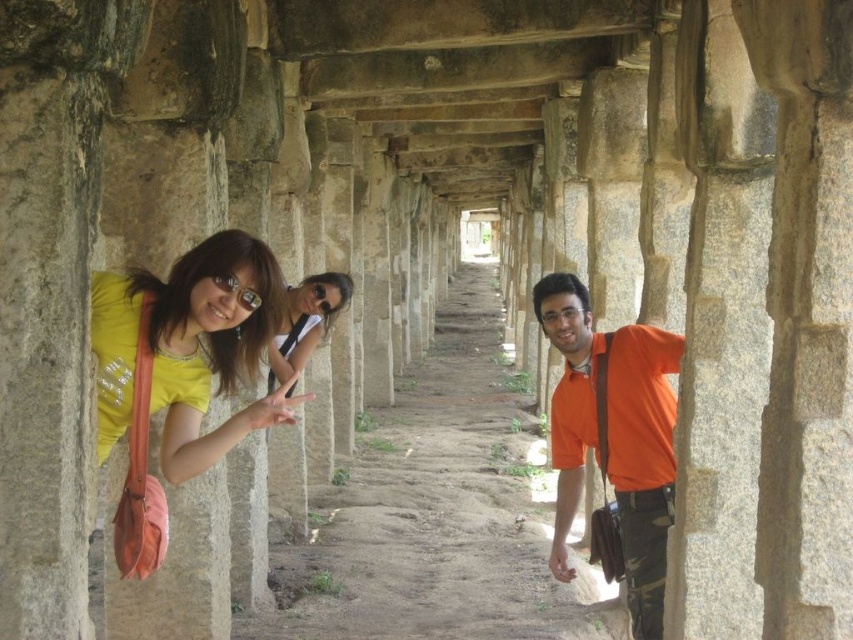
Between point (122, 305) and point (281, 371), which one is positioned behind?

Positioned behind is point (281, 371).

Does yellow fabric bag at left have a smaller size compared to sunglasses at center?

Incorrect, yellow fabric bag at left is not smaller in size than sunglasses at center.

At what (x,y) coordinates should I click in order to perform the action: click on yellow fabric bag at left. Please return your answer as a coordinate pair (x, y). The height and width of the screenshot is (640, 853). Looking at the image, I should click on (189, 346).

Who is higher up, yellow fabric bag at left or orange cotton shirt at center?

Positioned higher is yellow fabric bag at left.

Between yellow fabric bag at left and orange cotton shirt at center, which one has less height?

orange cotton shirt at center is shorter.

Who is more distant from viewer, (125,388) or (582,296)?

The point (582,296) is behind.

Locate an element on the screen. The width and height of the screenshot is (853, 640). yellow fabric bag at left is located at coordinates (189, 346).

Is orange cotton shirt at center taller than sunglasses at center?

Incorrect, orange cotton shirt at center's height is not larger of sunglasses at center's.

Who is positioned more to the left, orange cotton shirt at center or sunglasses at center?

sunglasses at center is more to the left.

What do you see at coordinates (614, 436) in the screenshot? I see `orange cotton shirt at center` at bounding box center [614, 436].

The height and width of the screenshot is (640, 853). Identify the location of orange cotton shirt at center. (614, 436).